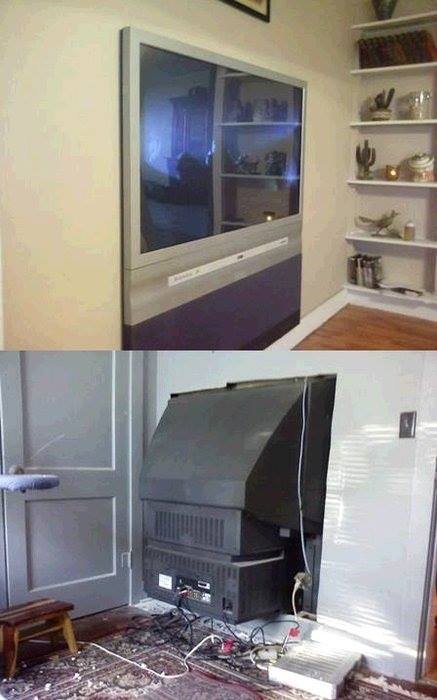
I want to click on door, so click(x=67, y=416).